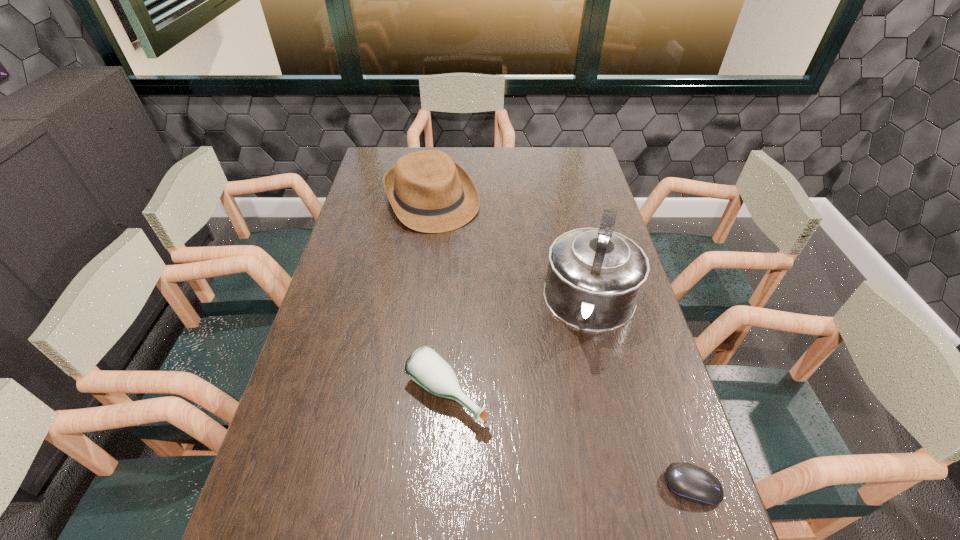
In order to click on free location located 0.280m on the front-facing side of the farthest object in this screenshot , I will do `click(479, 284)`.

Find the location of a particular element. This screenshot has height=540, width=960. free space located 0.310m on the front-facing side of the farthest object is located at coordinates (483, 291).

This screenshot has height=540, width=960. Find the location of `vacant region located 0.150m on the front-facing side of the farthest object`. vacant region located 0.150m on the front-facing side of the farthest object is located at coordinates (464, 258).

Locate an element on the screen. vacant point located with the spout at the front of the tallest object is located at coordinates (576, 397).

Identify the location of free space located 0.070m with the spout at the front of the tallest object. Image resolution: width=960 pixels, height=540 pixels. (581, 374).

Where is `vacant region located 0.290m with the spout at the front of the tallest object`? vacant region located 0.290m with the spout at the front of the tallest object is located at coordinates (564, 454).

Where is `object located at the far edge`? This screenshot has height=540, width=960. object located at the far edge is located at coordinates (429, 192).

You are a GUI agent. You are given a task and a screenshot of the screen. Output one action in this format:
    pyautogui.click(x=<x>, y=<y>)
    Task: Click on the object at the near edge
    The height and width of the screenshot is (540, 960).
    Given the screenshot: What is the action you would take?
    pyautogui.click(x=692, y=483)

The width and height of the screenshot is (960, 540). What are the coordinates of `object at the left edge` in the screenshot? It's located at (429, 192).

Where is `computer mouse that is at the right edge`? computer mouse that is at the right edge is located at coordinates (692, 483).